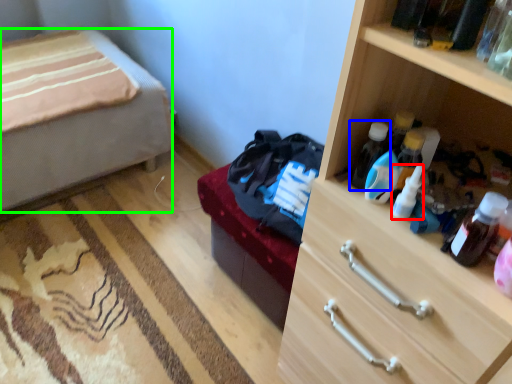
Question: Based on their relative distances, which object is farther from bottle (highlighted by a red box)? Choose from bottle (highlighted by a blue box) and desk (highlighted by a green box).

Choices:
 (A) bottle
 (B) desk

Answer: (B)